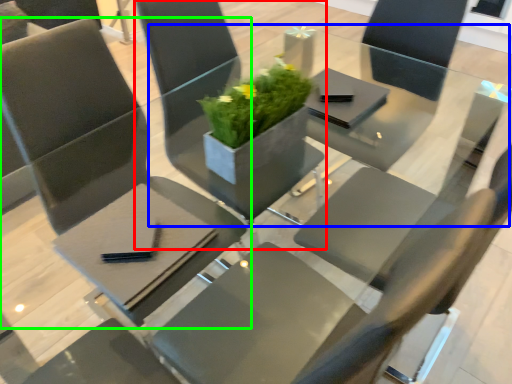
Question: Estimate the real-world distances between objects in this image. Which object is farther from chair (highlighted by a red box), round table (highlighted by a blue box) or chair (highlighted by a green box)?

Choices:
 (A) round table
 (B) chair

Answer: (A)